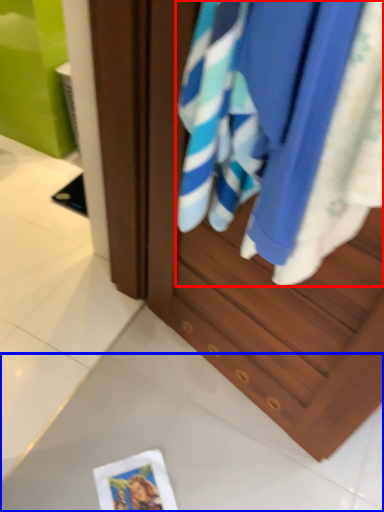
Question: Among these objects, which one is farthest to the camera, beach towel (highlighted by a red box) or tile (highlighted by a blue box)?

Choices:
 (A) beach towel
 (B) tile

Answer: (B)